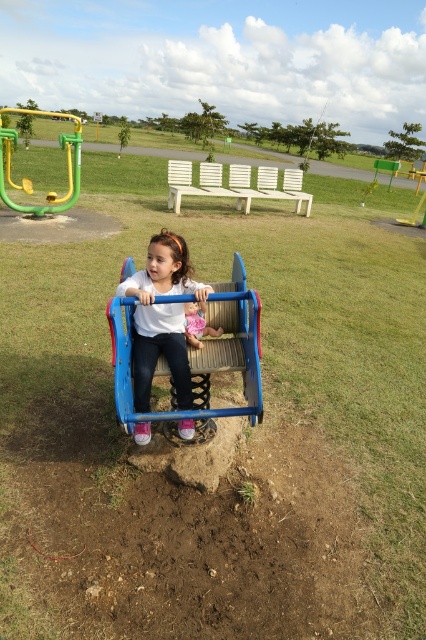
You are a parent trying to locate your child who is wearing a white matte shirt. Based on the scene, where would you find the white matte shirt at center relative to the green plastic monkey bars at upper left?

The white matte shirt at center is located below the green plastic monkey bars at upper left.